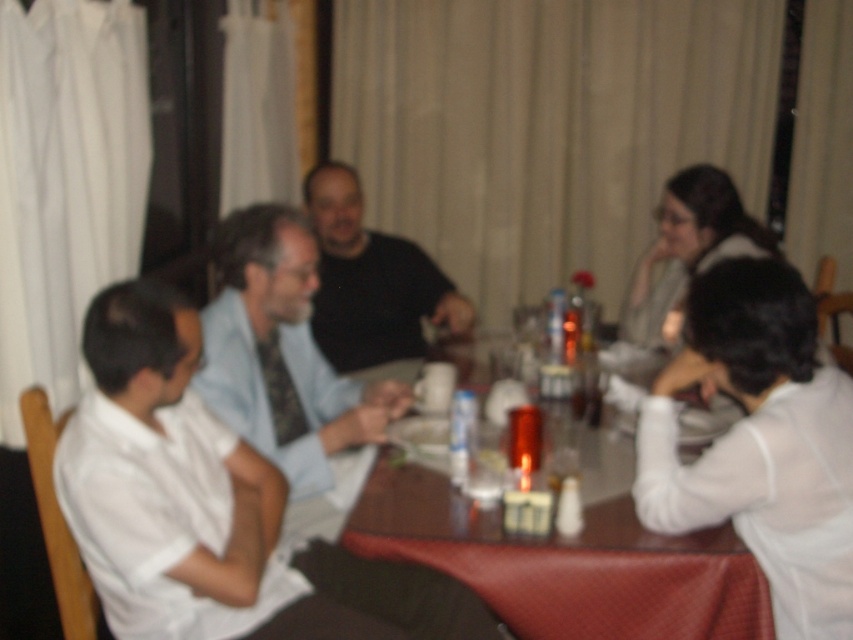
Can you confirm if smooth brown table at center is positioned below blue textured shirt at center?

Yes, smooth brown table at center is below blue textured shirt at center.

Does smooth brown table at center appear over blue textured shirt at center?

No.

Is point (550, 600) closer to camera compared to point (302, 460)?

Yes, point (550, 600) is in front of point (302, 460).

At what (x,y) coordinates should I click in order to perform the action: click on smooth brown table at center. Please return your answer as a coordinate pair (x, y). The width and height of the screenshot is (853, 640). Looking at the image, I should click on (566, 564).

Is blue textured shirt at center smaller than black matte shirt at center?

No.

Which of these two, blue textured shirt at center or black matte shirt at center, stands shorter?

black matte shirt at center

Between point (215, 333) and point (347, 232), which one is positioned behind?

The point (347, 232) is more distant.

This screenshot has height=640, width=853. What are the coordinates of `blue textured shirt at center` in the screenshot? It's located at (286, 369).

Is smooth brown table at center taller than black matte shirt at center?

Incorrect, smooth brown table at center's height is not larger of black matte shirt at center's.

Measure the distance from smooth brown table at center to black matte shirt at center.

smooth brown table at center is 1.21 meters from black matte shirt at center.

Identify the location of smooth brown table at center. (566, 564).